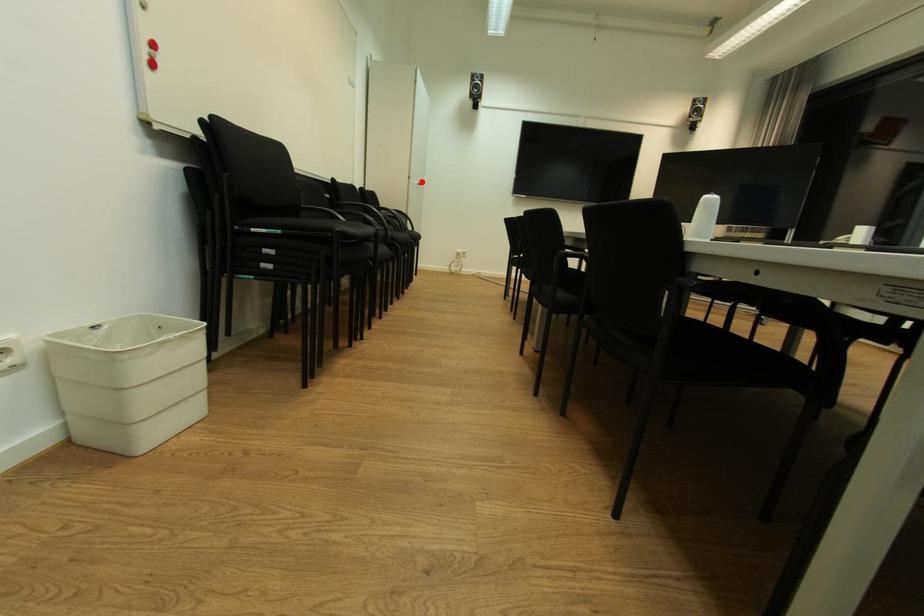
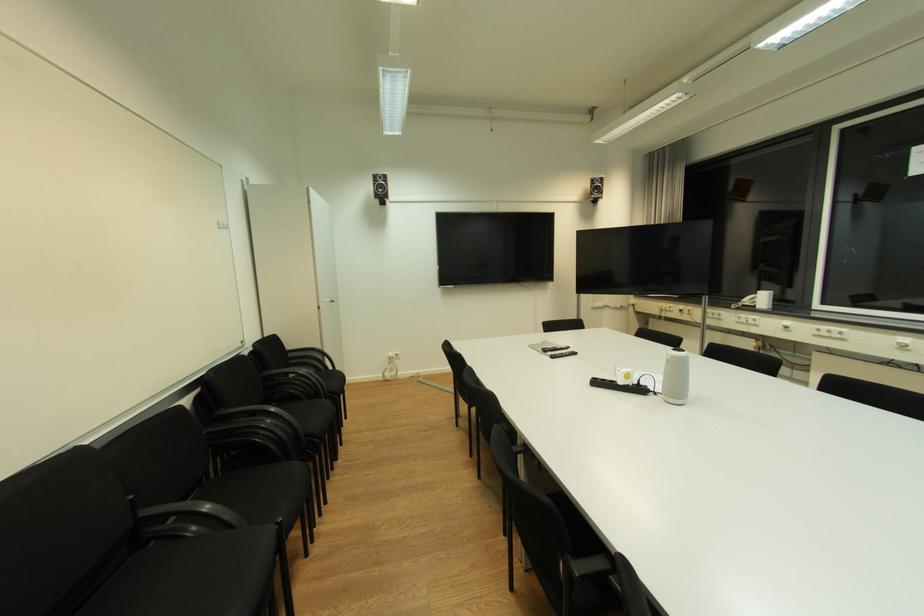
Find the pixel in the second image that matches the highlighted location in the first image.

(334, 301)